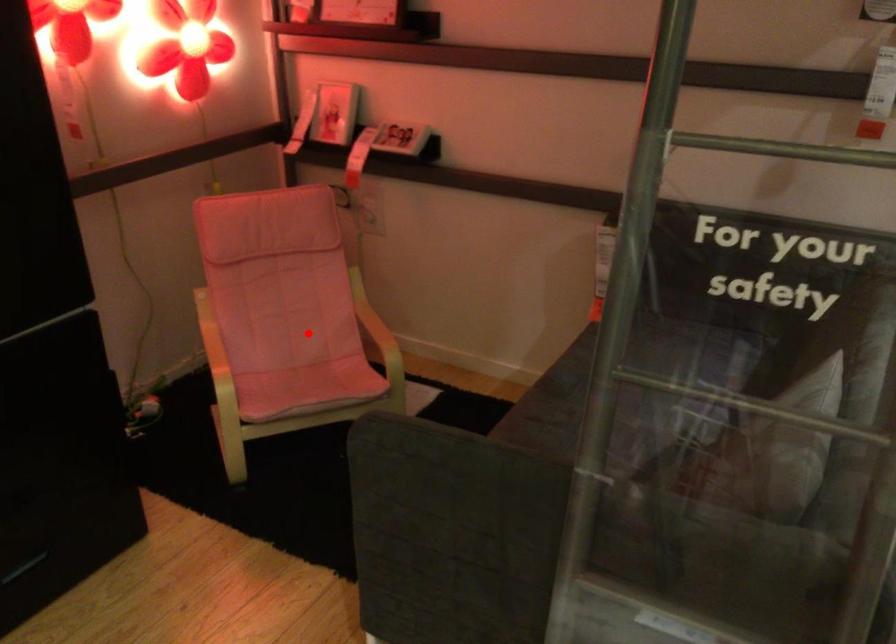
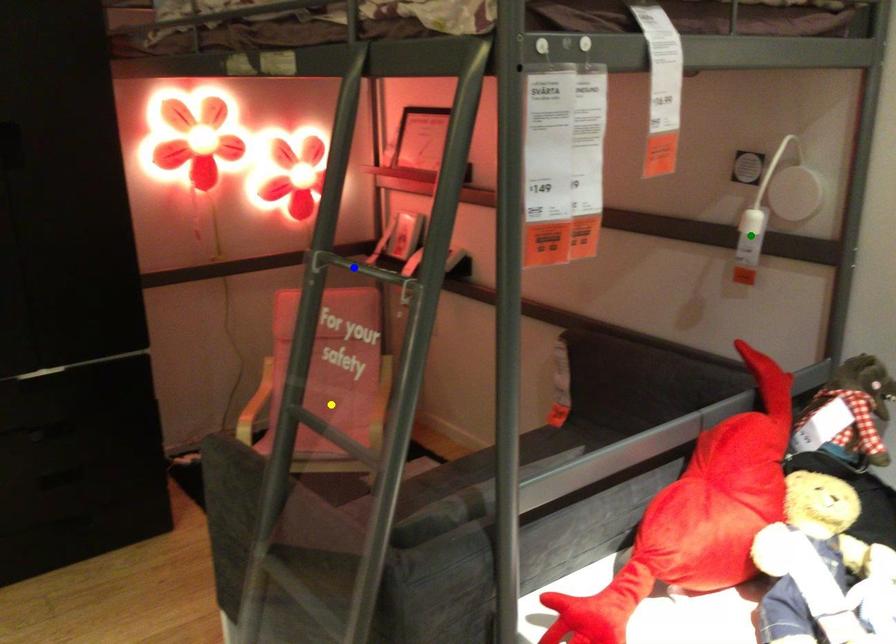
Question: I am providing you with two images of the same scene from different viewpoints. A red point is marked on the first image. You are given multiple points on the second image. Which point in image 2 represents the same 3d spot as the red point in image 1?

Choices:
 (A) yellow point
 (B) blue point
 (C) green point

Answer: (A)